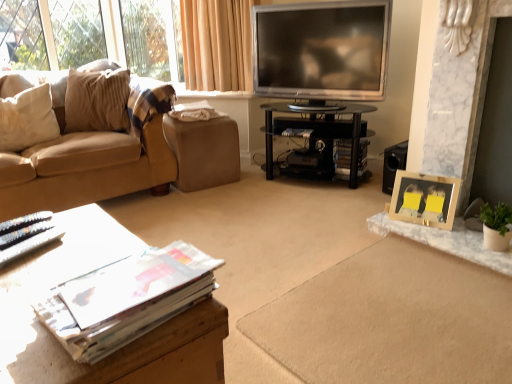
The width and height of the screenshot is (512, 384). What do you see at coordinates (297, 133) in the screenshot? I see `matte paper magazine at center, which is the second magazine from left to right` at bounding box center [297, 133].

Locate an element on the screen. This screenshot has height=384, width=512. white soft pillow at left is located at coordinates (27, 119).

This screenshot has width=512, height=384. What do you see at coordinates (204, 151) in the screenshot?
I see `brown leather footrest at center` at bounding box center [204, 151].

What do you see at coordinates (28, 236) in the screenshot?
I see `white glossy magazine at lower left, positioned as the first magazine in left-to-right order` at bounding box center [28, 236].

Find the location of a particular element. The width and height of the screenshot is (512, 384). matte paper magazine at center, which appears as the 2th magazine when viewed from the top is located at coordinates (342, 158).

Identify the location of wooden photo frame at right. (424, 199).

The height and width of the screenshot is (384, 512). Describe the element at coordinates (424, 199) in the screenshot. I see `wooden photo frame at right` at that location.

I want to click on matte paper magazine at center, positioned as the 1th magazine in top-to-bottom order, so click(297, 133).

Which is more to the right, beige corduroy couch at left or matte paper magazine at center, positioned as the third magazine in left-to-right order?

matte paper magazine at center, positioned as the third magazine in left-to-right order.

Consider the image. From a real-world perspective, is beige corduroy couch at left positioned above or below matte paper magazine at center, which appears as the third magazine when viewed from the front?

From a real-world perspective, beige corduroy couch at left is physically above matte paper magazine at center, which appears as the third magazine when viewed from the front.

From the image's perspective, between beige corduroy couch at left and matte paper magazine at center, which appears as the third magazine when viewed from the front, who is located below?

matte paper magazine at center, which appears as the third magazine when viewed from the front.

Would you say beige corduroy couch at left is a long distance from matte paper magazine at center, which is the first magazine from right to left?

Absolutely, beige corduroy couch at left is distant from matte paper magazine at center, which is the first magazine from right to left.

Is brown leather footrest at center further to camera compared to silver metallic television at upper center?

Yes, brown leather footrest at center is further from the camera.

How different are the orientations of brown leather footrest at center and silver metallic television at upper center in degrees?

They differ by 59.4 degrees in their facing directions.

Can you confirm if brown leather footrest at center is bigger than silver metallic television at upper center?

Actually, brown leather footrest at center might be smaller than silver metallic television at upper center.

Locate an element on the screen. The image size is (512, 384). footrest below the silver metallic television at upper center (from the image's perspective) is located at coordinates (204, 151).

Can you confirm if silver metallic television at upper center is wider than brown leather footrest at center?

No, silver metallic television at upper center is not wider than brown leather footrest at center.

Considering the relative sizes of silver metallic television at upper center and brown leather footrest at center in the image provided, is silver metallic television at upper center bigger than brown leather footrest at center?

Indeed, silver metallic television at upper center has a larger size compared to brown leather footrest at center.

From the image's perspective, is silver metallic television at upper center positioned above or below brown leather footrest at center?

silver metallic television at upper center is above brown leather footrest at center.

Would you say white soft pillow at left contains beige corduroy couch at left?

No, beige corduroy couch at left is not inside white soft pillow at left.

How much distance is there between white soft pillow at left and beige corduroy couch at left?

white soft pillow at left and beige corduroy couch at left are 11.40 inches apart.

Does white soft pillow at left have a lesser width compared to beige corduroy couch at left?

Indeed, white soft pillow at left has a lesser width compared to beige corduroy couch at left.

The height and width of the screenshot is (384, 512). In order to click on pillow on the left of beige corduroy couch at left in this screenshot , I will do `click(27, 119)`.

Is black glass tv stand at center, which is the first table in right-to-left order, directly adjacent to beige corduroy couch at left?

No, black glass tv stand at center, which is the first table in right-to-left order, is not touching beige corduroy couch at left.

From the image's perspective, which is above, black glass tv stand at center, the second table in the left-to-right sequence, or beige corduroy couch at left?

beige corduroy couch at left, from the image's perspective.

Could you tell me if black glass tv stand at center, which is the first table in right-to-left order, is turned towards beige corduroy couch at left?

No, black glass tv stand at center, which is the first table in right-to-left order, is not facing towards beige corduroy couch at left.

Considering the relative sizes of black glass tv stand at center, positioned as the 2th table in front-to-back order, and beige corduroy couch at left in the image provided, is black glass tv stand at center, positioned as the 2th table in front-to-back order, shorter than beige corduroy couch at left?

Yes, black glass tv stand at center, positioned as the 2th table in front-to-back order, is shorter than beige corduroy couch at left.

Is white soft pillow at left far away from matte paper magazine at center, arranged as the 2th magazine when viewed from the front?

Indeed, white soft pillow at left is not near matte paper magazine at center, arranged as the 2th magazine when viewed from the front.

Does white soft pillow at left have a lesser height compared to matte paper magazine at center, which ranks as the second magazine in back-to-front order?

No, white soft pillow at left is not shorter than matte paper magazine at center, which ranks as the second magazine in back-to-front order.

Does white soft pillow at left lie behind matte paper magazine at center, acting as the third magazine starting from the bottom?

That is False.

Is point (25, 102) closer or farther from the camera than point (307, 130)?

Clearly, point (25, 102) is closer to the camera than point (307, 130).

Which is in front, point (298, 130) or point (327, 145)?

The point (298, 130) is closer to the camera.

Between matte paper magazine at center, which is the second magazine from left to right, and black glass tv stand at center, the first table positioned from the top, which one appears on the right side from the viewer's perspective?

black glass tv stand at center, the first table positioned from the top, is more to the right.

In the scene shown: Could you tell me if matte paper magazine at center, which ranks as the second magazine in back-to-front order, is facing black glass tv stand at center, positioned as the 2th table in front-to-back order?

Yes.

What's the angular difference between matte paper magazine at center, which is the second magazine from left to right, and black glass tv stand at center, the second table in the left-to-right sequence,'s facing directions?

They differ by 7.6 degrees in their facing directions.

Find the location of `magazine that is the 2nd object located below the beige corduroy couch at left (from the image's perspective)`. magazine that is the 2nd object located below the beige corduroy couch at left (from the image's perspective) is located at coordinates (342, 158).

This screenshot has height=384, width=512. Identify the location of television in front of the brown leather footrest at center. (322, 50).

When comparing their distances from matte paper magazine at center, the 2th magazine from the right, does brown leather footrest at center or wooden table at lower left, which appears as the 1th table when ordered from the bottom, seem further?

wooden table at lower left, which appears as the 1th table when ordered from the bottom, lies further to matte paper magazine at center, the 2th magazine from the right, than the other object.

Based on their spatial positions, is white glossy magazine at lower left, arranged as the 3th magazine when viewed from the back, or matte paper magazine at center, which is the second magazine from left to right, further from beige corduroy couch at left?

The object further to beige corduroy couch at left is matte paper magazine at center, which is the second magazine from left to right.

From the image, which object appears to be nearer to white soft pillow at left, silver metallic television at upper center or black glass tv stand at center, the first table positioned from the top?

The object closer to white soft pillow at left is black glass tv stand at center, the first table positioned from the top.

When comparing their distances from white glossy magazine at lower left, the 3th magazine positioned from the right, does brown leather footrest at center or black glass tv stand at center, the first table positioned from the top, seem further?

Among the two, black glass tv stand at center, the first table positioned from the top, is located further to white glossy magazine at lower left, the 3th magazine positioned from the right.

Looking at the image, which one is located closer to wooden table at lower left, which is counted as the second table, starting from the right, matte paper magazine at center, the 2th magazine from the right, or brown leather footrest at center?

brown leather footrest at center lies closer to wooden table at lower left, which is counted as the second table, starting from the right, than the other object.

From the image, which object appears to be nearer to silver metallic television at upper center, wooden photo frame at right or brown leather footrest at center?

Based on the image, brown leather footrest at center appears to be nearer to silver metallic television at upper center.

Based on their spatial positions, is matte paper magazine at center, which appears as the 1th magazine when viewed from the back, or black glass tv stand at center, the second table in the left-to-right sequence, further from white glossy magazine at lower left, positioned as the first magazine in left-to-right order?

matte paper magazine at center, which appears as the 1th magazine when viewed from the back.

Based on their spatial positions, is black glass tv stand at center, positioned as the 2th table in front-to-back order, or wooden table at lower left, the 1th table from the left, further from beige corduroy couch at left?

wooden table at lower left, the 1th table from the left.

I want to click on magazine positioned between wooden table at lower left, which is counted as the second table, starting from the right, and silver metallic television at upper center from near to far, so click(x=28, y=236).

The width and height of the screenshot is (512, 384). What are the coordinates of `magazine positioned between wooden table at lower left, which is counted as the second table, starting from the right, and matte paper magazine at center, the 2th magazine from the right, from near to far` in the screenshot? It's located at (28, 236).

I want to click on television between white glossy magazine at lower left, which is counted as the first magazine, starting from the bottom, and wooden photo frame at right, in the horizontal direction, so pyautogui.click(x=322, y=50).

Identify the location of table between wooden table at lower left, which is the 1th table from front to back, and matte paper magazine at center, which is the first magazine from right to left, from front to back. [x=317, y=137].